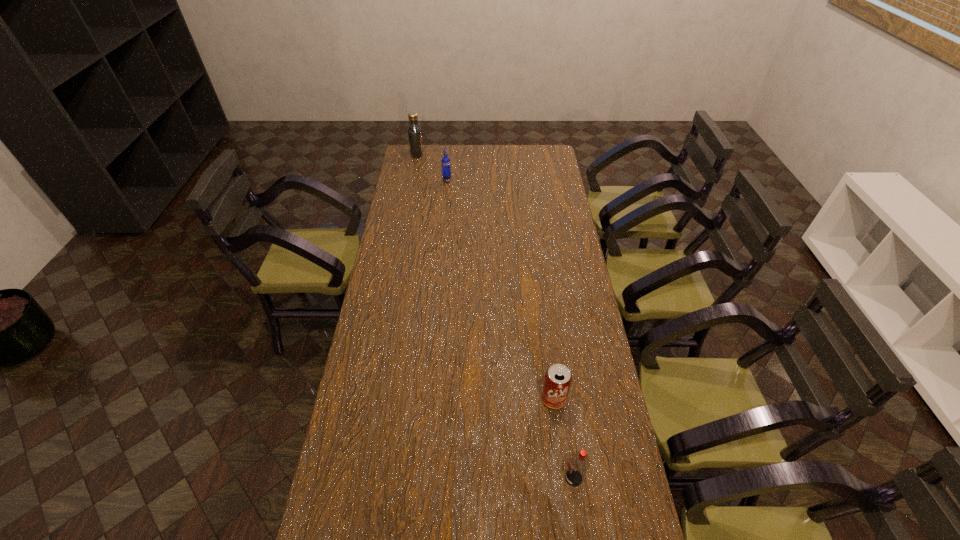
Locate an element on the screen. The image size is (960, 540). free space between the tallest object and the soda can is located at coordinates (486, 276).

Locate an element on the screen. free space between the soda can and the leftmost object is located at coordinates tap(486, 276).

Find the location of `object that can be found as the second closest to the farthest object`. object that can be found as the second closest to the farthest object is located at coordinates [x=557, y=381].

This screenshot has height=540, width=960. What are the coordinates of `object identified as the second closest to the farthest object` in the screenshot? It's located at point(557,381).

Identify which vodka is located as the nearest to the third nearest object. Please provide its 2D coordinates. Your answer should be formatted as a tuple, i.e. [(x, y)], where the tuple contains the x and y coordinates of a point satisfying the conditions above.

[(414, 131)]

At what (x,y) coordinates should I click in order to perform the action: click on vodka identified as the second closest to the soda can. Please return your answer as a coordinate pair (x, y). This screenshot has height=540, width=960. Looking at the image, I should click on (x=446, y=167).

Where is `vacant space that satisfies the following two spatial constraints: 1. on the front-facing side of the leftmost object; 2. on the back side of the soda can`? Image resolution: width=960 pixels, height=540 pixels. vacant space that satisfies the following two spatial constraints: 1. on the front-facing side of the leftmost object; 2. on the back side of the soda can is located at coordinates (371, 399).

You are a GUI agent. You are given a task and a screenshot of the screen. Output one action in this format:
    pyautogui.click(x=<x>, y=<y>)
    Task: Click on the vacant region that satisfies the following two spatial constraints: 1. on the back side of the second nearest object; 2. on the front-facing side of the leftmost vodka
    The height and width of the screenshot is (540, 960).
    Given the screenshot: What is the action you would take?
    pyautogui.click(x=522, y=153)

Locate an element on the screen. The width and height of the screenshot is (960, 540). free space that satisfies the following two spatial constraints: 1. on the back side of the soda can; 2. on the front-facing side of the farthest object is located at coordinates (522, 153).

You are a GUI agent. You are given a task and a screenshot of the screen. Output one action in this format:
    pyautogui.click(x=<x>, y=<y>)
    Task: Click on the free region that satisfies the following two spatial constraints: 1. on the front-facing side of the farthest object; 2. on the right side of the second farthest vodka
    Image resolution: width=960 pixels, height=540 pixels.
    Given the screenshot: What is the action you would take?
    pyautogui.click(x=412, y=181)